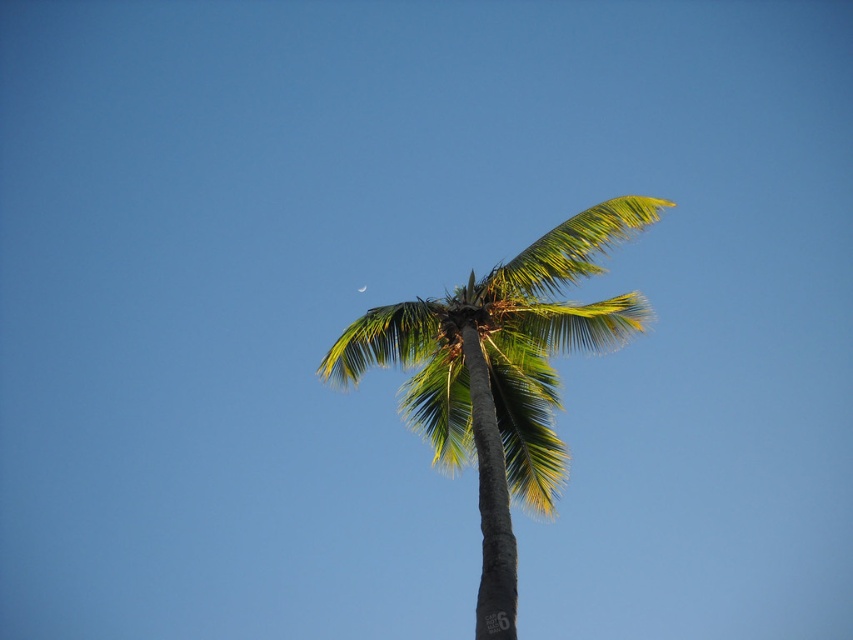
You are an astronomer observing the sky and the green leafy coconut tree at center. You notice the silvery reflective crescent at upper center. Can you determine if the crescent is above or below the tree?

The green leafy coconut tree at center is located below the silvery reflective crescent at upper center, so the crescent is above the tree.

You are an astronomer observing the sky and the green leafy coconut tree at center and the silvery reflective crescent at upper center. Which object is positioned to the left?

The silvery reflective crescent at upper center is positioned to the left of the green leafy coconut tree at center.

You are standing in a garden and want to water the green leafy coconut tree at center. If your watering can has a range of 50 feet, will you be able to water it without moving closer?

The green leafy coconut tree at center is 51.86 feet away from the viewer. Since the watering can only reaches 50 feet, you will need to move closer to water it.